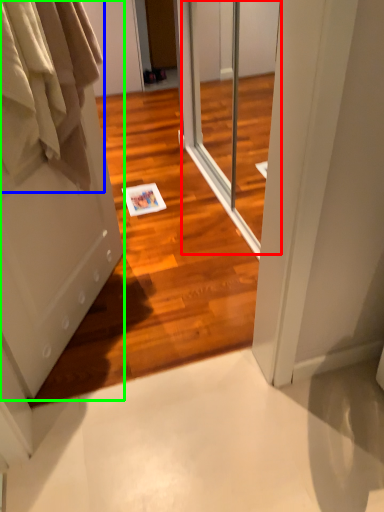
Question: Estimate the real-world distances between objects in this image. Which object is closer to screen door (highlighted by a red box), clothing (highlighted by a blue box) or door (highlighted by a green box)?

Choices:
 (A) clothing
 (B) door

Answer: (B)